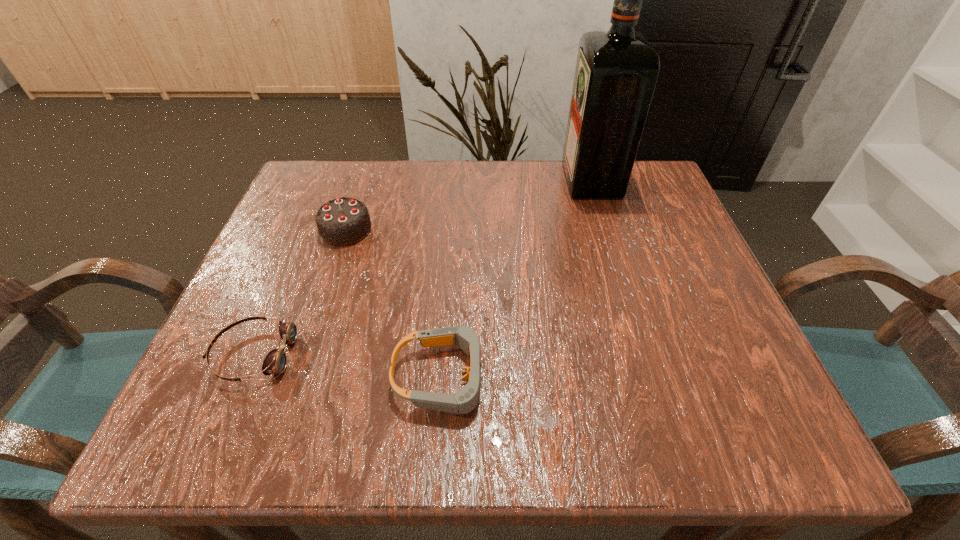
The width and height of the screenshot is (960, 540). I want to click on free spot between the taller goggles and the left goggles, so click(348, 366).

Image resolution: width=960 pixels, height=540 pixels. What are the coordinates of `vacant area that lies between the shortest object and the third nearest object` in the screenshot? It's located at (300, 292).

The image size is (960, 540). I want to click on vacant area that lies between the shorter goggles and the chocolate cake, so click(x=300, y=292).

The image size is (960, 540). I want to click on free space that is in between the shortest object and the liquor, so click(x=422, y=267).

I want to click on free space between the shorter goggles and the second object from right to left, so click(348, 366).

Locate an element on the screen. This screenshot has width=960, height=540. vacant space that's between the tallest object and the left goggles is located at coordinates (422, 267).

Locate an element on the screen. This screenshot has height=540, width=960. free space between the liquor and the third shortest object is located at coordinates (468, 205).

Find the location of a particular element. This screenshot has width=960, height=540. empty space between the second object from right to left and the shortest object is located at coordinates (348, 366).

I want to click on the closest object to the third nearest object, so click(x=275, y=362).

Point out which object is positioned as the second nearest to the left goggles. Please provide its 2D coordinates. Your answer should be formatted as a tuple, i.e. [(x, y)], where the tuple contains the x and y coordinates of a point satisfying the conditions above.

[(343, 221)]